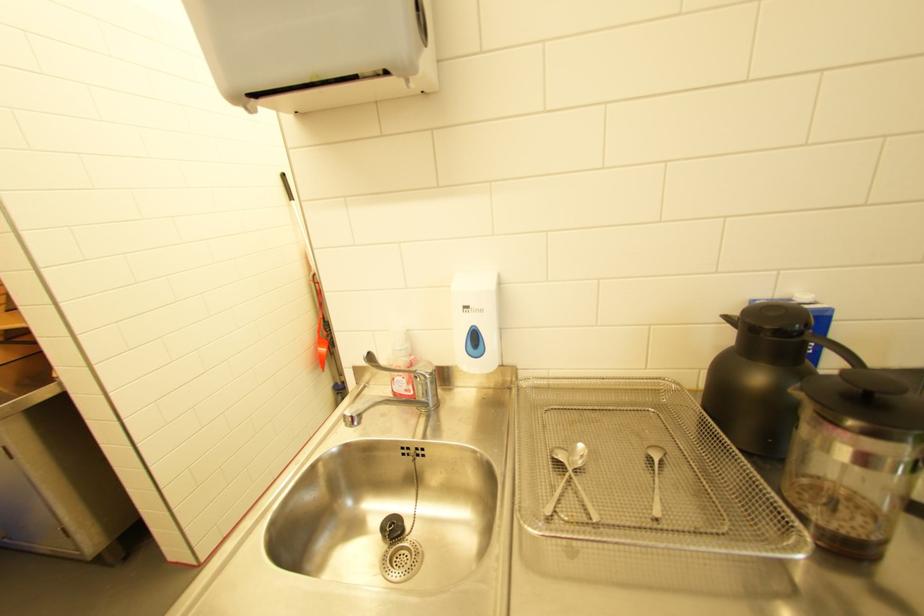
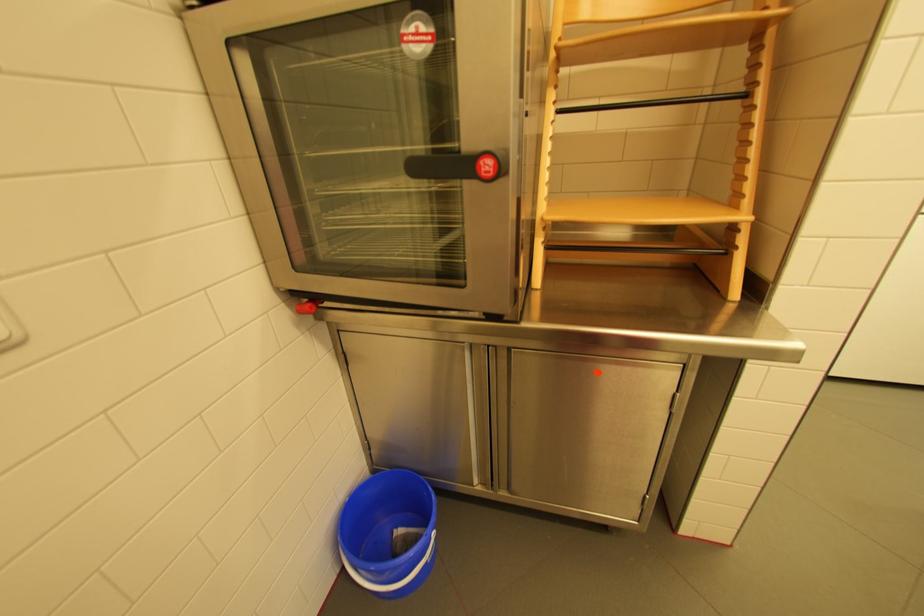
Question: The images are taken continuously from a first-person perspective. In which direction are you moving?

Choices:
 (A) Left
 (B) Right
 (C) Forward
 (D) Backward

Answer: (A)